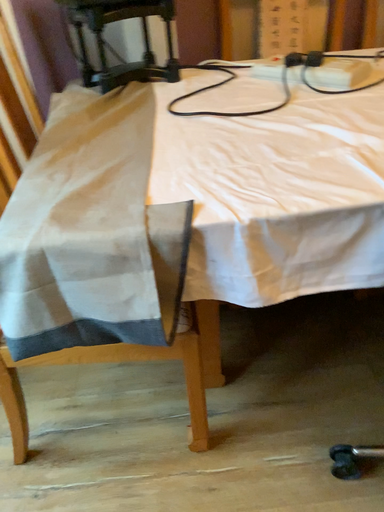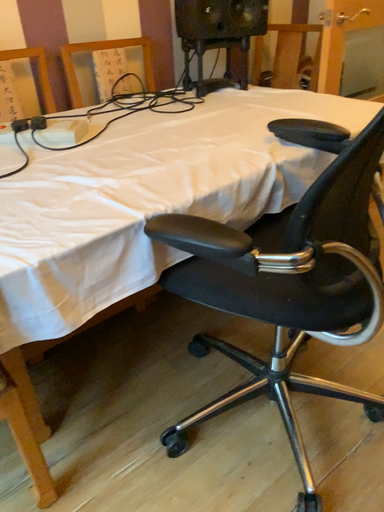
Question: How did the camera likely rotate when shooting the video?

Choices:
 (A) rotated upward
 (B) rotated downward

Answer: (A)